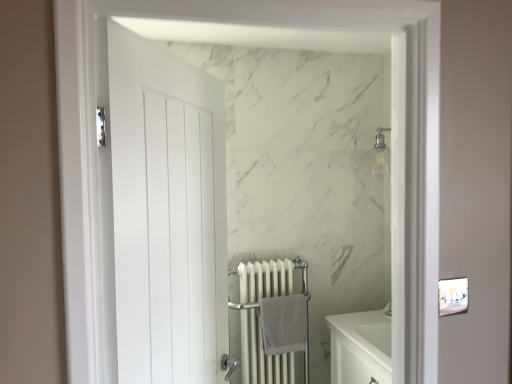
Question: From a real-world perspective, is white matte door at left physically above gray cotton bath towel at center?

Choices:
 (A) no
 (B) yes

Answer: (B)

Question: Is white matte door at left wider than gray cotton bath towel at center?

Choices:
 (A) yes
 (B) no

Answer: (A)

Question: Is white matte door at left to the right of gray cotton bath towel at center from the viewer's perspective?

Choices:
 (A) yes
 (B) no

Answer: (B)

Question: Is white matte door at left thinner than gray cotton bath towel at center?

Choices:
 (A) yes
 (B) no

Answer: (B)

Question: Is gray cotton bath towel at center surrounded by white matte door at left?

Choices:
 (A) no
 (B) yes

Answer: (A)

Question: In terms of height, does white metal radiator at center look taller or shorter compared to gray cotton bath towel at center?

Choices:
 (A) tall
 (B) short

Answer: (A)

Question: Is white metal radiator at center situated inside gray cotton bath towel at center or outside?

Choices:
 (A) outside
 (B) inside

Answer: (A)

Question: Considering their positions, is white metal radiator at center located in front of or behind gray cotton bath towel at center?

Choices:
 (A) behind
 (B) front

Answer: (B)

Question: In terms of width, does white metal radiator at center look wider or thinner when compared to gray cotton bath towel at center?

Choices:
 (A) thin
 (B) wide

Answer: (B)

Question: Considering the positions of white metal radiator at center and white matte door at left in the image, is white metal radiator at center taller or shorter than white matte door at left?

Choices:
 (A) tall
 (B) short

Answer: (B)

Question: From a real-world perspective, is white metal radiator at center above or below white matte door at left?

Choices:
 (A) below
 (B) above

Answer: (A)

Question: Is white metal radiator at center in front of or behind white matte door at left in the image?

Choices:
 (A) front
 (B) behind

Answer: (B)

Question: From the image's perspective, relative to white matte door at left, is white metal radiator at center above or below?

Choices:
 (A) above
 (B) below

Answer: (B)

Question: From a real-world perspective, relative to white metal radiator at center, is gray cotton bath towel at center vertically above or below?

Choices:
 (A) above
 (B) below

Answer: (A)

Question: Is gray cotton bath towel at center situated inside white metal radiator at center or outside?

Choices:
 (A) outside
 (B) inside

Answer: (B)